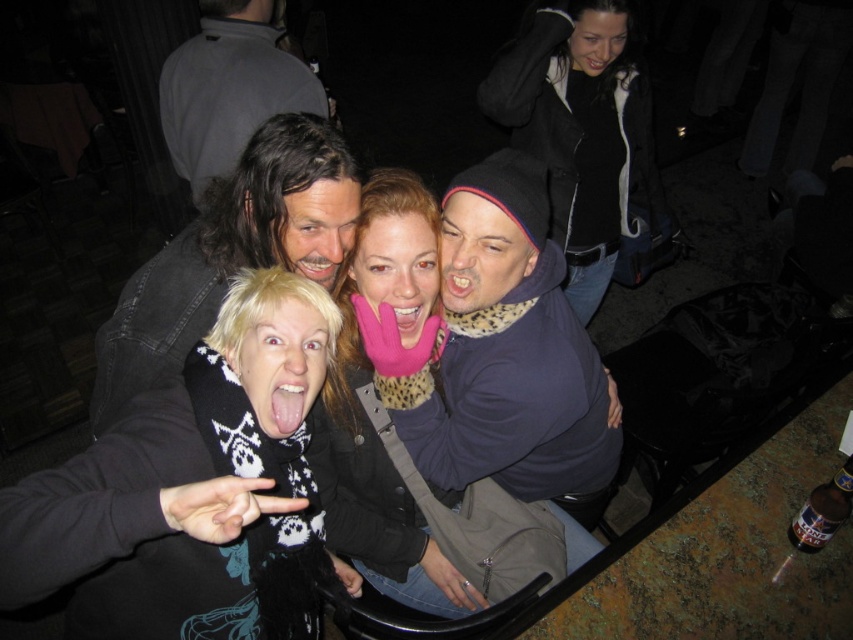
Is dark brown hair at center positioned in front of brown glass bottle at lower right?

Yes, it is.

Which of these two, dark brown hair at center or brown glass bottle at lower right, stands taller?

With more height is dark brown hair at center.

Between point (282, 204) and point (828, 529), which one is positioned in front?

Point (282, 204) is in front.

I want to click on dark brown hair at center, so click(229, 252).

Between black leather jacket at upper right and brown glass bottle at lower right, which one has less height?

Standing shorter between the two is brown glass bottle at lower right.

How far apart are black leather jacket at upper right and brown glass bottle at lower right?

They are 3.97 feet apart.

You are a GUI agent. You are given a task and a screenshot of the screen. Output one action in this format:
    pyautogui.click(x=<x>, y=<y>)
    Task: Click on the black leather jacket at upper right
    This screenshot has height=640, width=853.
    Given the screenshot: What is the action you would take?
    pyautogui.click(x=581, y=132)

Who is more forward, (x=242, y=355) or (x=215, y=186)?

Point (x=242, y=355)

Does black and white scarf at lower left appear on the left side of dark brown hair at center?

Incorrect, black and white scarf at lower left is not on the left side of dark brown hair at center.

Who is more distant from viewer, (132, 612) or (132, 339)?

The point (132, 339) is more distant.

This screenshot has width=853, height=640. In order to click on black and white scarf at lower left in this screenshot , I will do `click(184, 488)`.